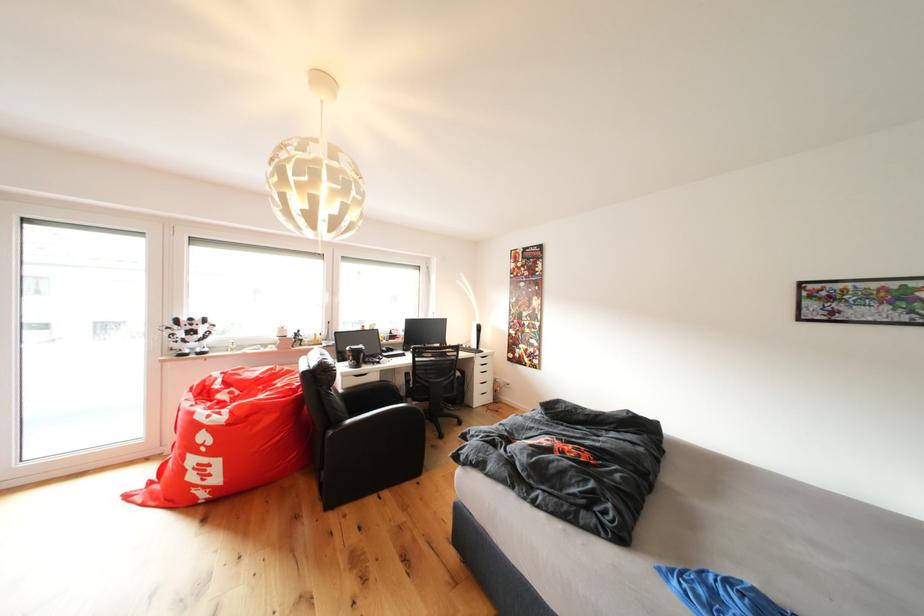
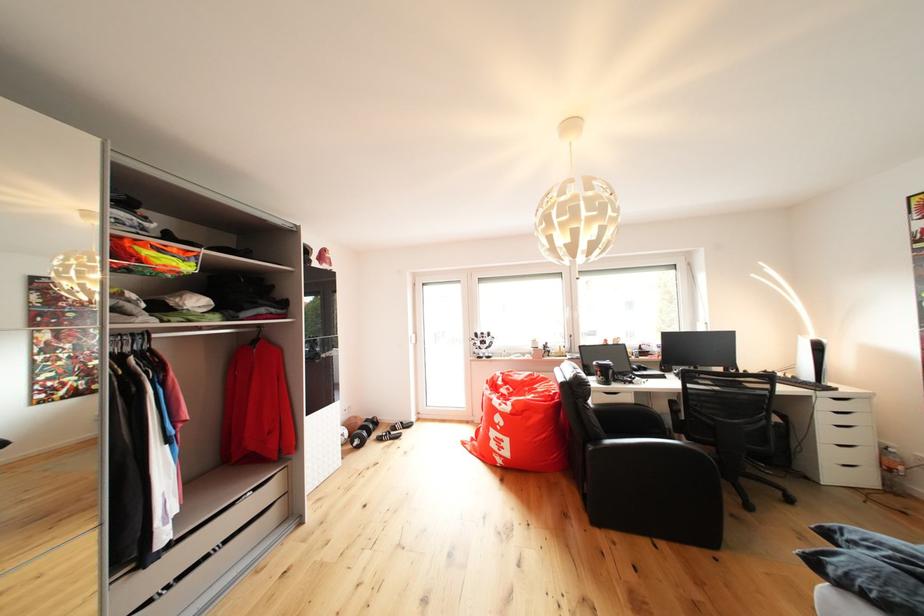
Where in the second image is the point corresponding to [497,382] from the first image?

(869, 444)